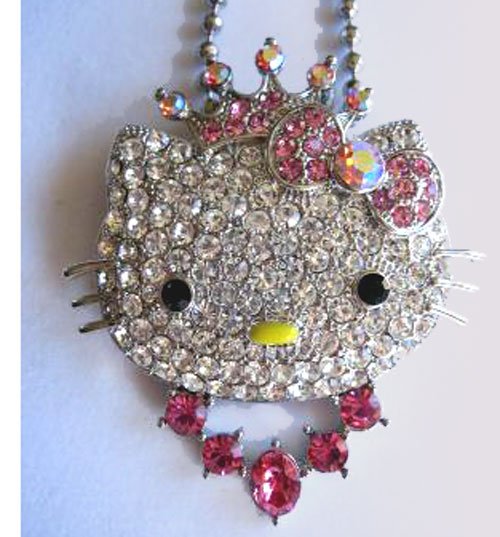
You are a GUI agent. You are given a task and a screenshot of the screen. Output one action in this format:
    pyautogui.click(x=<x>, y=<y>)
    Task: Click on the table
    This screenshot has height=537, width=500.
    Given the screenshot: What is the action you would take?
    pyautogui.click(x=80, y=496)